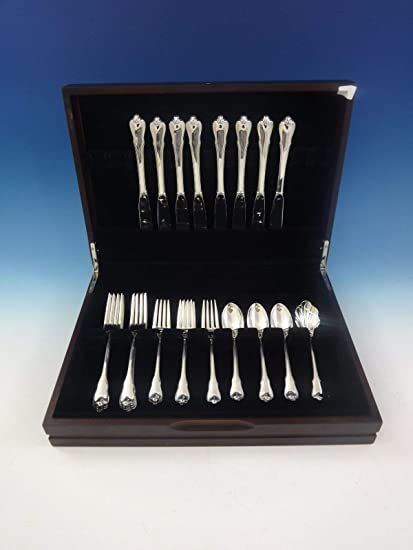
The height and width of the screenshot is (550, 413). What are the coordinates of `spoons` in the screenshot? It's located at (234, 328), (255, 327), (280, 323), (309, 317).